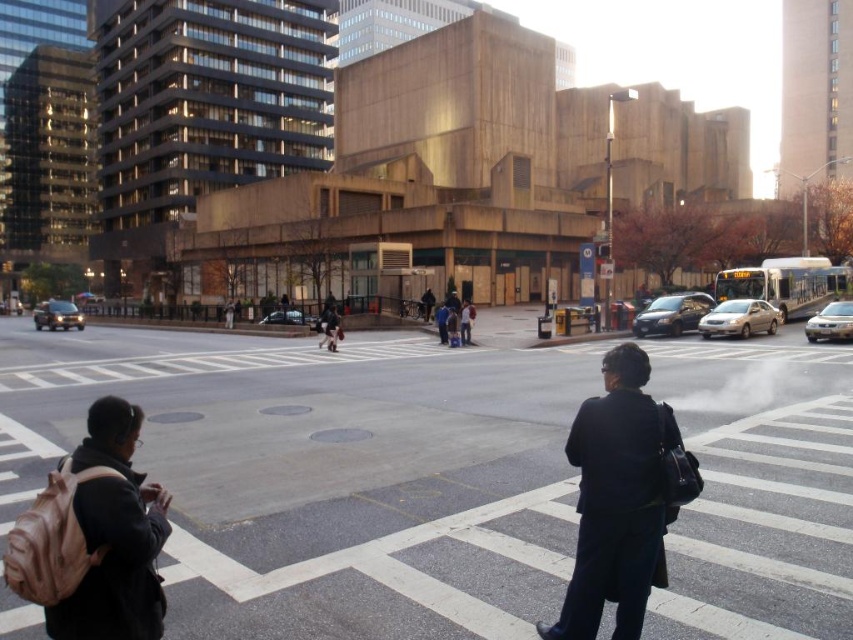
Question: Can you confirm if dark blue coat at center is positioned to the left of beige fabric backpack at lower left?

Choices:
 (A) yes
 (B) no

Answer: (B)

Question: Which of these objects is positioned closest to the beige fabric backpack at lower left?

Choices:
 (A) dark blue coat at center
 (B) dark gray asphalt at center

Answer: (A)

Question: Which point is closer to the camera taking this photo?

Choices:
 (A) (140, 529)
 (B) (567, 468)
 (C) (585, 452)

Answer: (A)

Question: Considering the real-world distances, which object is farthest from the dark gray asphalt at center?

Choices:
 (A) dark blue coat at center
 (B) beige fabric backpack at lower left

Answer: (B)

Question: Can you confirm if dark gray asphalt at center is wider than beige fabric backpack at lower left?

Choices:
 (A) no
 (B) yes

Answer: (B)

Question: Does dark gray asphalt at center lie behind dark blue coat at center?

Choices:
 (A) no
 (B) yes

Answer: (B)